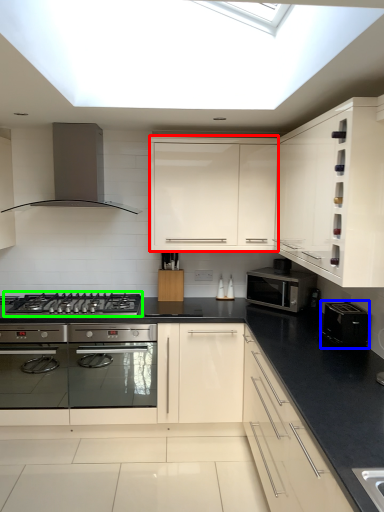
Question: Based on their relative distances, which object is nearer to cabinetry (highlighted by a red box)? Choose from appliance (highlighted by a blue box) and gas stove (highlighted by a green box).

Choices:
 (A) appliance
 (B) gas stove

Answer: (B)